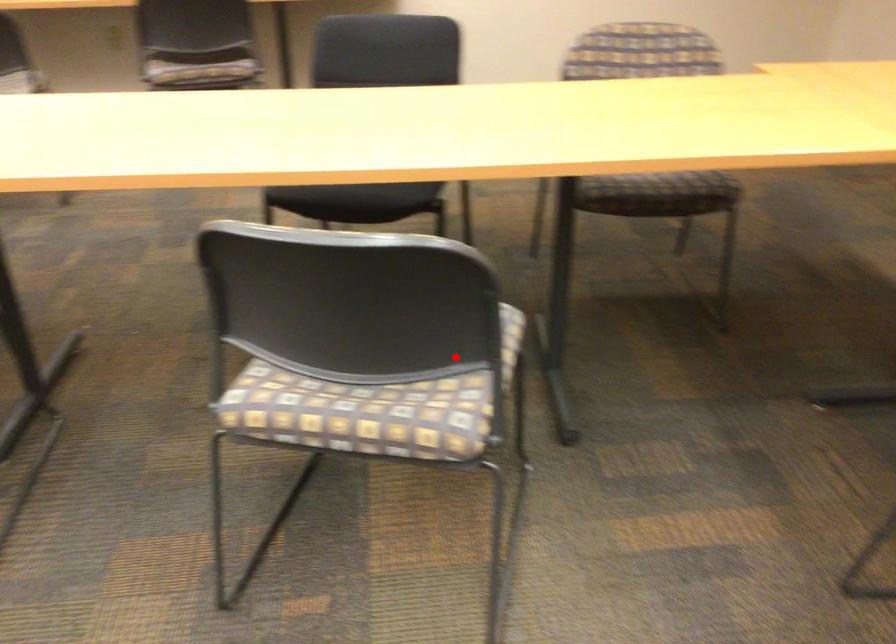
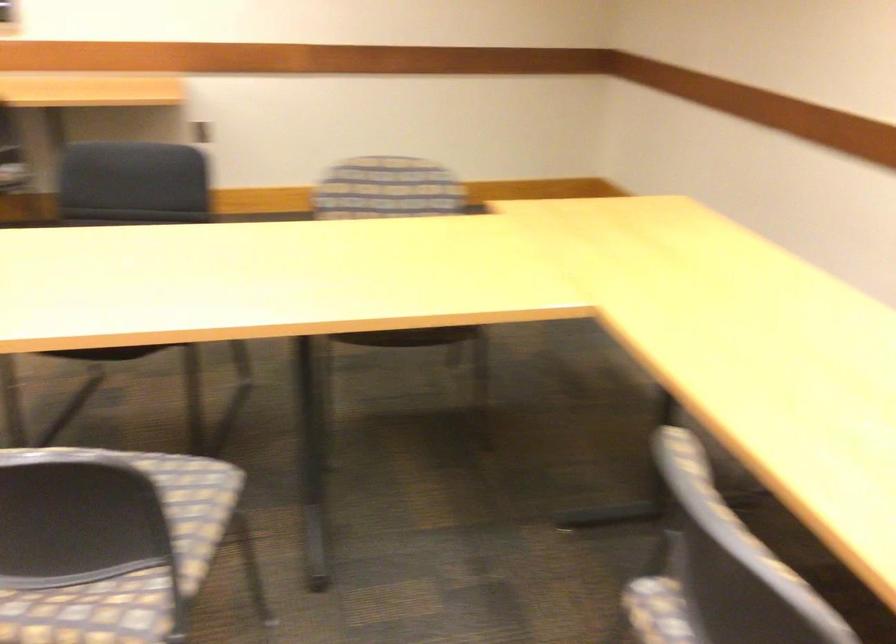
Where in the second image is the point corresponding to the highlighted location from the first image?

(126, 558)